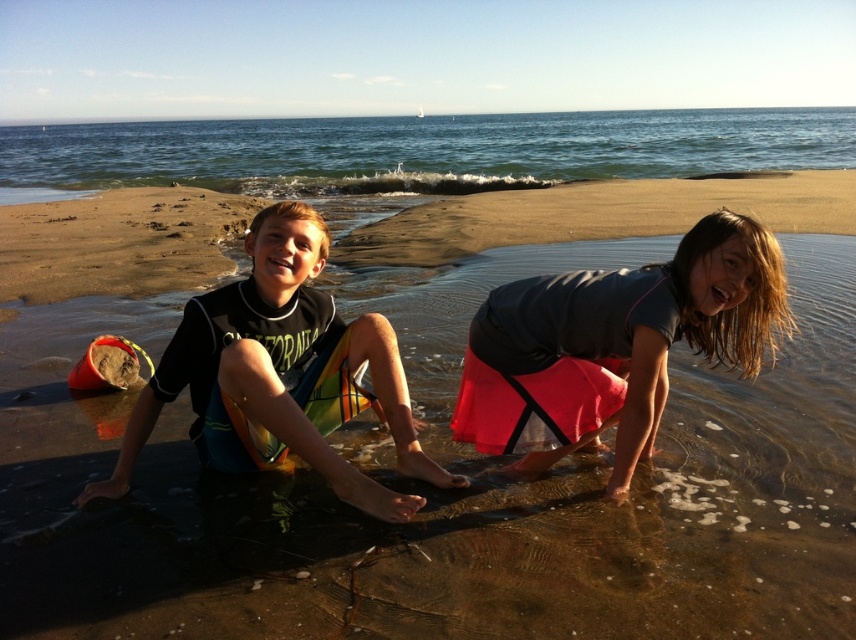
Does smooth sand at lower center appear under green water at upper center?

Yes, smooth sand at lower center is below green water at upper center.

Is point (181, 554) behind point (146, 147)?

No, (181, 554) is in front of (146, 147).

Is point (581, 502) closer to camera compared to point (432, 136)?

Yes, point (581, 502) is in front of point (432, 136).

Locate an element on the screen. This screenshot has width=856, height=640. smooth sand at lower center is located at coordinates (438, 509).

Between matte pink skirt at lower right and black wetsuit at center, which one is positioned higher?

matte pink skirt at lower right

Who is positioned more to the left, matte pink skirt at lower right or black wetsuit at center?

Positioned to the left is black wetsuit at center.

Between point (729, 296) and point (100, 484), which one is positioned in front?

Positioned in front is point (729, 296).

Locate an element on the screen. This screenshot has height=640, width=856. matte pink skirt at lower right is located at coordinates (615, 344).

Between smooth sand at lower center and matte pink skirt at lower right, which one has more height?

Standing taller between the two is matte pink skirt at lower right.

Does smooth sand at lower center have a lesser height compared to matte pink skirt at lower right?

Yes, smooth sand at lower center is shorter than matte pink skirt at lower right.

Between point (84, 564) and point (580, 372), which one is positioned in front?

Positioned in front is point (84, 564).

Find the location of a particular element. Image resolution: width=856 pixels, height=640 pixels. smooth sand at lower center is located at coordinates (438, 509).